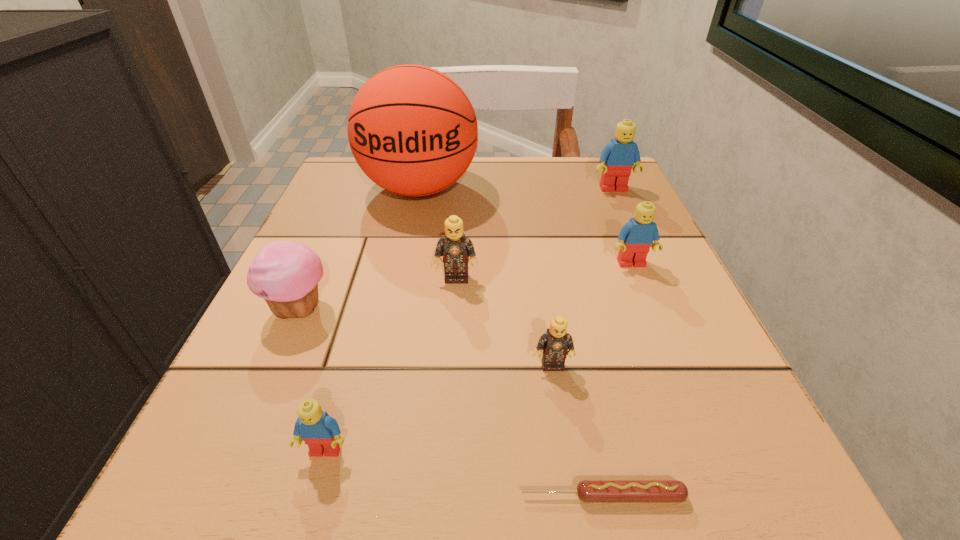
Image resolution: width=960 pixels, height=540 pixels. What are the coordinates of `vacant space at the near right corner of the desktop` in the screenshot? It's located at (745, 490).

The image size is (960, 540). Find the location of `empty space that is in between the third Lego from right to left and the tallest object`. empty space that is in between the third Lego from right to left and the tallest object is located at coordinates (486, 277).

This screenshot has height=540, width=960. What are the coordinates of `empty space between the farthest blue Lego and the brown sausage` in the screenshot? It's located at (608, 342).

At what (x,y) coordinates should I click in order to perform the action: click on vacant point located between the cupcake and the third nearest object. Please return your answer as a coordinate pair (x, y). The width and height of the screenshot is (960, 540). Looking at the image, I should click on (426, 337).

You are a GUI agent. You are given a task and a screenshot of the screen. Output one action in this format:
    pyautogui.click(x=<x>, y=<y>)
    Task: Click on the free spot between the smaller tan Lego and the tallest Lego
    The image size is (960, 540).
    Given the screenshot: What is the action you would take?
    pyautogui.click(x=583, y=277)

Locate an element on the screen. The height and width of the screenshot is (540, 960). free space that is in between the second farthest Lego and the left tan Lego is located at coordinates (544, 271).

This screenshot has height=540, width=960. I want to click on vacant space that is in between the nearest object and the tallest object, so click(511, 342).

The width and height of the screenshot is (960, 540). Identify the location of vacant point located between the tallest object and the shortest object. (511, 342).

Locate an element on the screen. This screenshot has width=960, height=540. free space between the tallest Lego and the sausage is located at coordinates (608, 342).

Locate an element on the screen. free space that is in between the brown sausage and the left tan Lego is located at coordinates (529, 387).